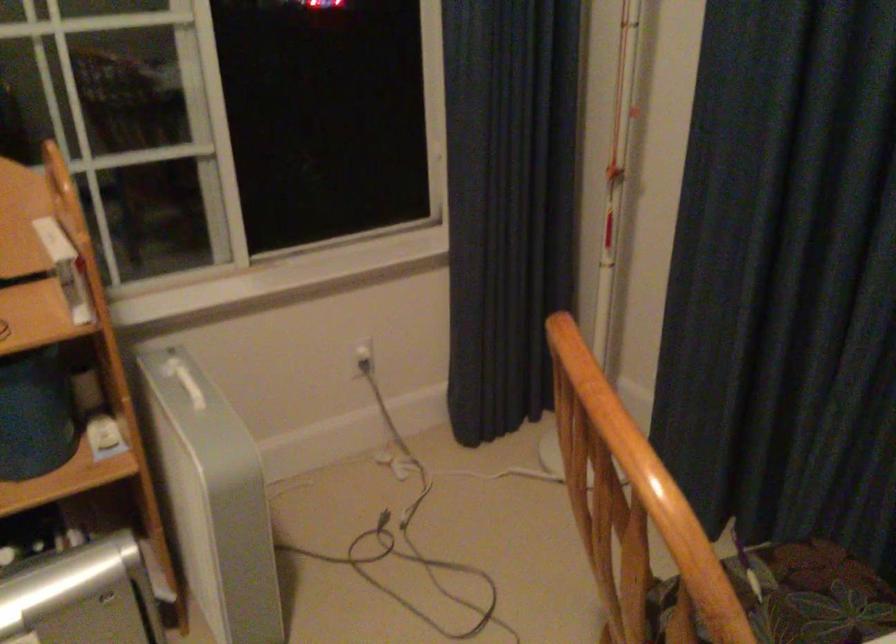
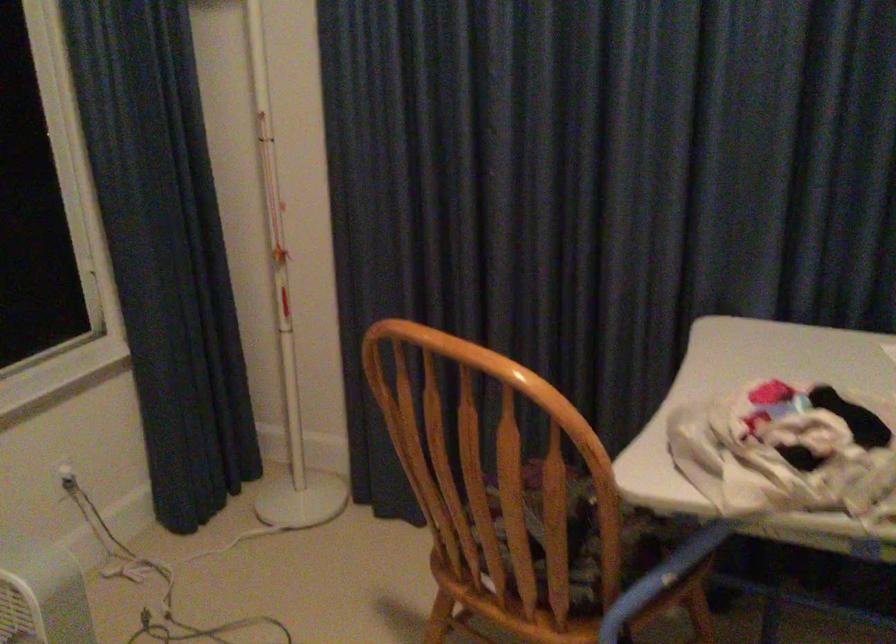
Find the pixel in the second image that matches (414,111) in the first image.

(66, 230)